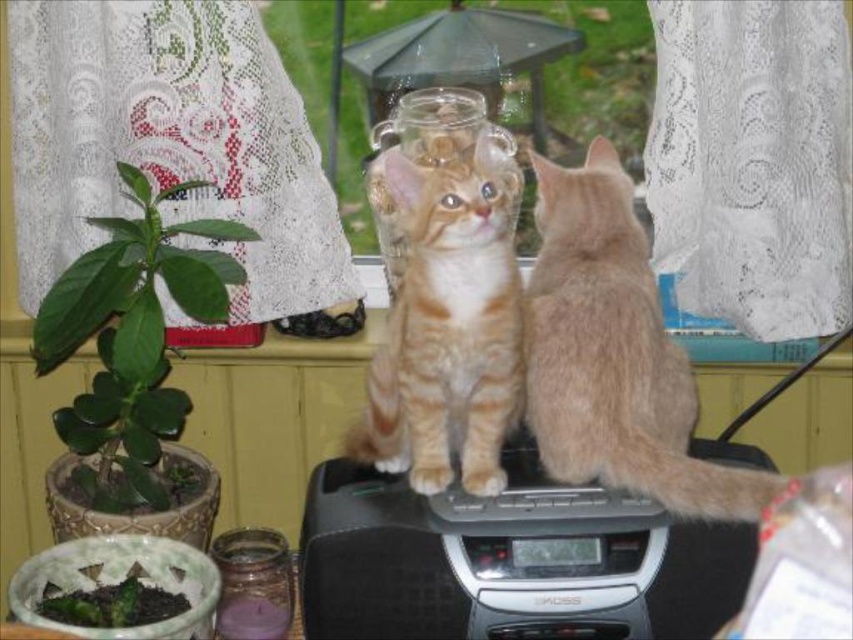
Question: Which object is farther from the camera taking this photo?

Choices:
 (A) orange tabby cat at center
 (B) green matte plant at left
 (C) transparent glass candle at center

Answer: (C)

Question: Can you confirm if black plastic radio at center is bigger than green matte plant at left?

Choices:
 (A) no
 (B) yes

Answer: (A)

Question: Which of these objects is positioned closest to the transparent glass candle at center?

Choices:
 (A) orange tabby cat at center
 (B) fuzzy beige cat at upper center

Answer: (A)

Question: Can you confirm if black plastic radio at center is smaller than green leafy plant at center?

Choices:
 (A) no
 (B) yes

Answer: (B)

Question: Estimate the real-world distances between objects in this image. Which object is closer to the orange tabby cat at center?

Choices:
 (A) black plastic radio at center
 (B) green matte plant at left

Answer: (A)

Question: Can you confirm if black plastic radio at center is positioned below fuzzy beige cat at upper center?

Choices:
 (A) yes
 (B) no

Answer: (A)